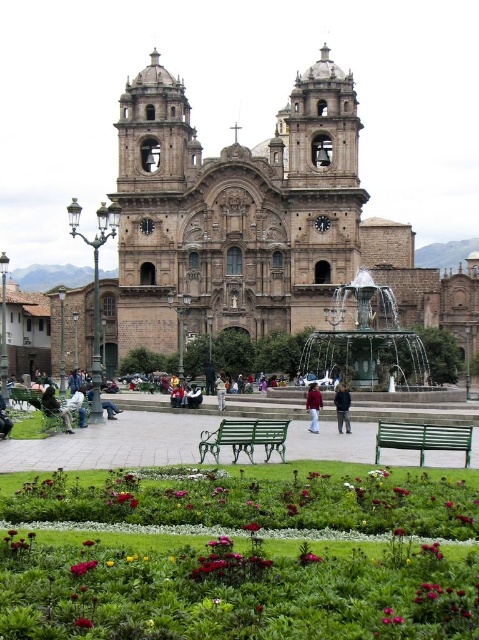
Question: Considering the real-world distances, which object is farthest from the green painted wood park bench at lower right?

Choices:
 (A) white cotton shirt at center
 (B) dark blue jacket at center
 (C) smooth pink rose at lower center

Answer: (C)

Question: Which of the following is the closest to the observer?

Choices:
 (A) smooth red flower at center
 (B) light blue denim jacket at lower left

Answer: (A)

Question: Which of the following is the farthest from the observer?

Choices:
 (A) (94, 541)
 (B) (310, 406)
 (C) (55, 413)

Answer: (C)

Question: Does brown stone church at center have a smaller size compared to dark gray fabric jacket at lower left?

Choices:
 (A) no
 (B) yes

Answer: (A)

Question: Does brown stone church at center appear over smooth pink petal at lower center?

Choices:
 (A) no
 (B) yes

Answer: (B)

Question: Is smooth pink petal at lower center to the right of smooth red flower at center from the viewer's perspective?

Choices:
 (A) yes
 (B) no

Answer: (A)